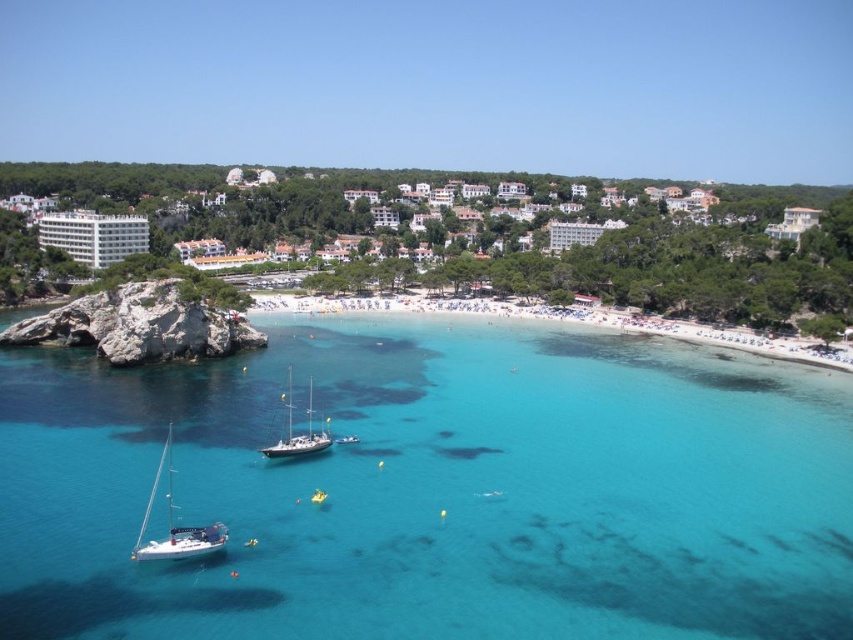
Question: Is white glossy sailboat at lower left smaller than white glossy sailboat at center?

Choices:
 (A) no
 (B) yes

Answer: (A)

Question: Does white sand beach at center appear on the right side of white glossy sailboat at center?

Choices:
 (A) yes
 (B) no

Answer: (A)

Question: Does clear blue water at center have a greater width compared to white glossy sailboat at lower left?

Choices:
 (A) no
 (B) yes

Answer: (B)

Question: Which of these objects is positioned farthest from the white sand beach at center?

Choices:
 (A) white glossy sailboat at lower left
 (B) white glossy sailboat at center

Answer: (A)

Question: Considering the real-world distances, which object is closest to the clear blue water at center?

Choices:
 (A) white glossy sailboat at center
 (B) white sand beach at center

Answer: (A)

Question: Which point is closer to the camera?

Choices:
 (A) white glossy sailboat at lower left
 (B) white sand beach at center
 (C) white glossy sailboat at center
 (D) clear blue water at center

Answer: (D)